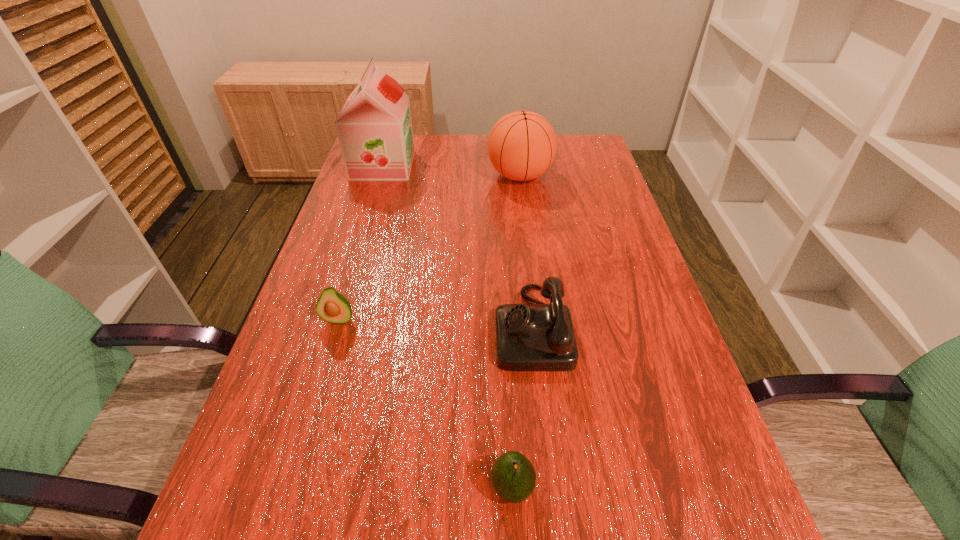
This screenshot has width=960, height=540. What are the coordinates of `the tallest object` in the screenshot? It's located at (374, 127).

The width and height of the screenshot is (960, 540). Find the location of `basketball`. basketball is located at coordinates (522, 145).

This screenshot has height=540, width=960. What are the coordinates of `telephone` in the screenshot? It's located at (529, 337).

Identify the location of the farther avocado. Image resolution: width=960 pixels, height=540 pixels. (332, 306).

Where is `the nearer avocado`? the nearer avocado is located at coordinates (513, 476).

Locate an element on the screen. the right avocado is located at coordinates (513, 476).

Locate an element on the screen. The image size is (960, 540). vacant space situated 0.300m with the cap open on the tallest object is located at coordinates (507, 165).

Locate an element on the screen. The width and height of the screenshot is (960, 540). vacant position located 0.360m on the front of the basketball is located at coordinates (533, 281).

Find the location of a particular element. This screenshot has height=540, width=960. vacant space situated on the dial of the telephone is located at coordinates (457, 327).

Where is `vacant space situated 0.360m on the dial of the telephone`? Image resolution: width=960 pixels, height=540 pixels. vacant space situated 0.360m on the dial of the telephone is located at coordinates (323, 327).